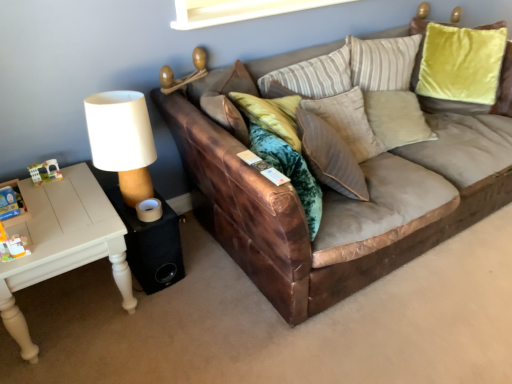
Identify the location of vacant space in white painted wood table at left (from a real-world perspective). (80, 310).